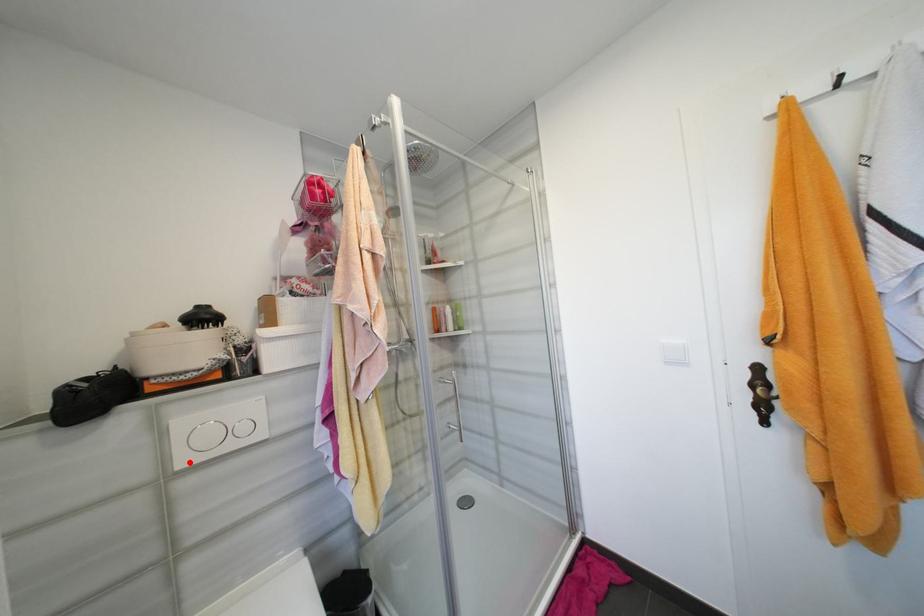
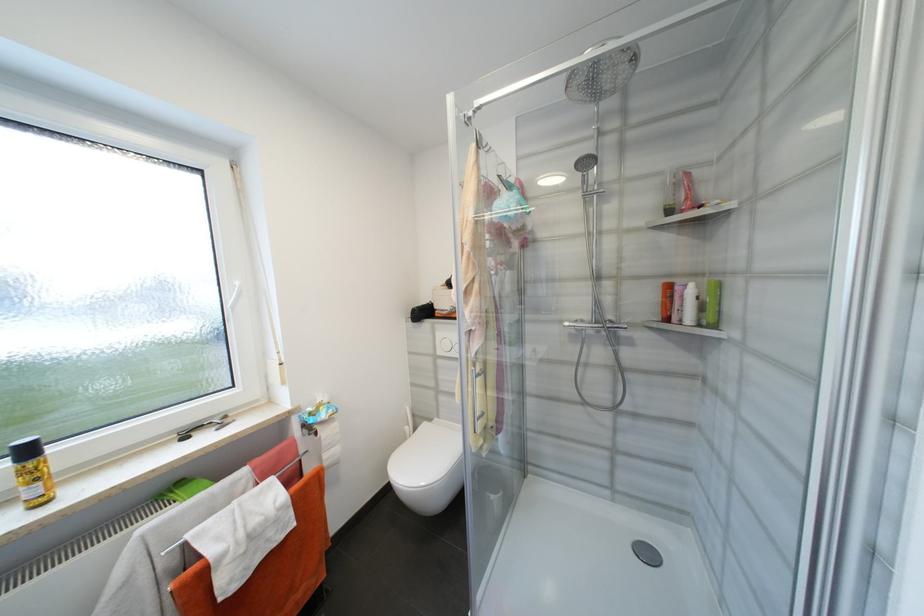
Locate, in the second image, the point that corresponds to the highlighted location in the first image.

(445, 353)